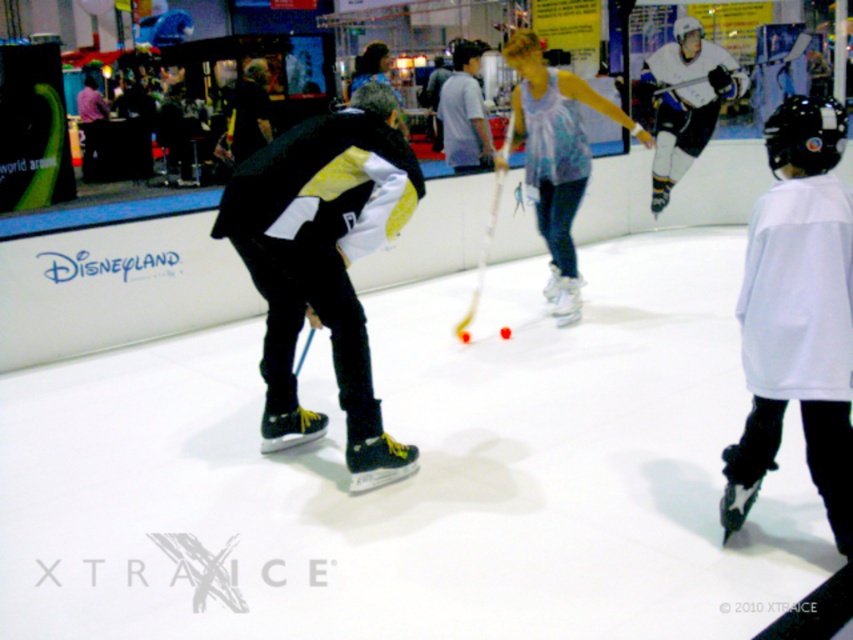
Question: Is black matte hockey stick at center smaller than white cotton shirt at center?

Choices:
 (A) yes
 (B) no

Answer: (B)

Question: Observing the image, what is the correct spatial positioning of white matte jersey at right in reference to white cotton shirt at center?

Choices:
 (A) above
 (B) below

Answer: (B)

Question: Among these objects, which one is farthest from the camera?

Choices:
 (A) white matte jersey at right
 (B) white cotton shirt at center
 (C) black matte hockey stick at center

Answer: (B)

Question: Among these objects, which one is nearest to the camera?

Choices:
 (A) black matte hockey stick at center
 (B) rubber/soft hockey at center

Answer: (A)

Question: Which point appears farthest from the camera in this image?

Choices:
 (A) (456, 64)
 (B) (788, 131)

Answer: (A)

Question: Is black matte hockey stick at center bigger than light blue fabric shirt at center?

Choices:
 (A) yes
 (B) no

Answer: (B)